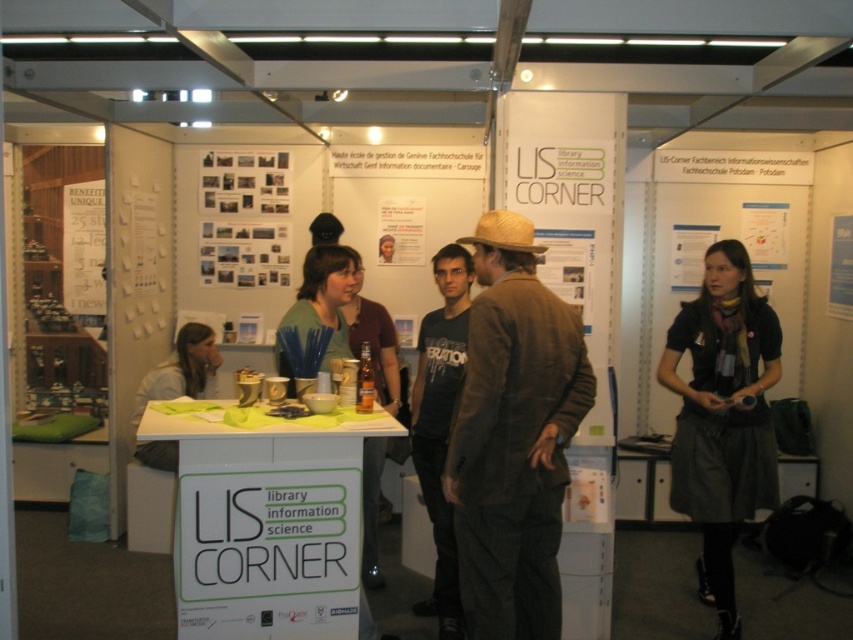
Which is in front, point (529, 481) or point (94, 285)?

Point (529, 481)

Does brown woolen jacket at center have a lesser height compared to white paper poster at left?

Incorrect, brown woolen jacket at center's height does not fall short of white paper poster at left's.

What are the coordinates of `brown woolen jacket at center` in the screenshot? It's located at (514, 436).

Measure the distance between dark gray skirt at right and white paper at upper center.

The distance of dark gray skirt at right from white paper at upper center is 5.27 feet.

Who is positioned more to the right, dark gray skirt at right or white paper at upper center?

From the viewer's perspective, white paper at upper center appears more on the right side.

Does point (741, 272) lie behind point (688, 241)?

No, (741, 272) is in front of (688, 241).

Where is `dark gray skirt at right`? dark gray skirt at right is located at coordinates (722, 417).

Which of these two, green fabric shirt at center or white paper poster at upper right, stands taller?

Standing taller between the two is green fabric shirt at center.

Between green fabric shirt at center and white paper poster at upper right, which one appears on the left side from the viewer's perspective?

Positioned to the left is green fabric shirt at center.

This screenshot has height=640, width=853. In order to click on green fabric shirt at center in this screenshot , I will do `click(321, 301)`.

At what (x,y) coordinates should I click in order to perform the action: click on green fabric shirt at center. Please return your answer as a coordinate pair (x, y). Image resolution: width=853 pixels, height=640 pixels. Looking at the image, I should click on (321, 301).